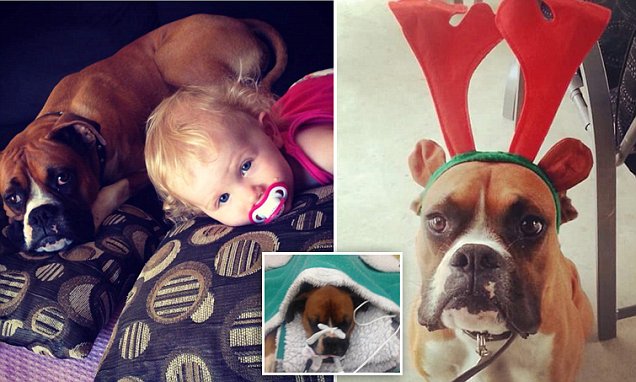
The width and height of the screenshot is (636, 382). I want to click on pillow, so click(x=95, y=293), click(x=194, y=302), click(x=374, y=339).